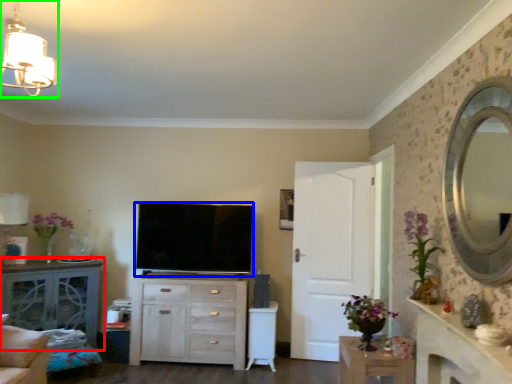
Question: Which is nearer to the table (highlighted by a red box)? television (highlighted by a blue box) or lamp (highlighted by a green box).

Choices:
 (A) television
 (B) lamp

Answer: (A)